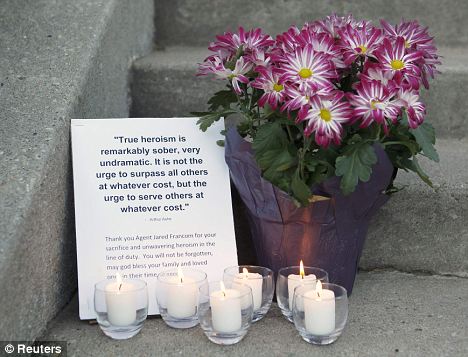
Where is `stairs`? The image size is (468, 357). stairs is located at coordinates (428, 231), (453, 103), (193, 15), (170, 86).